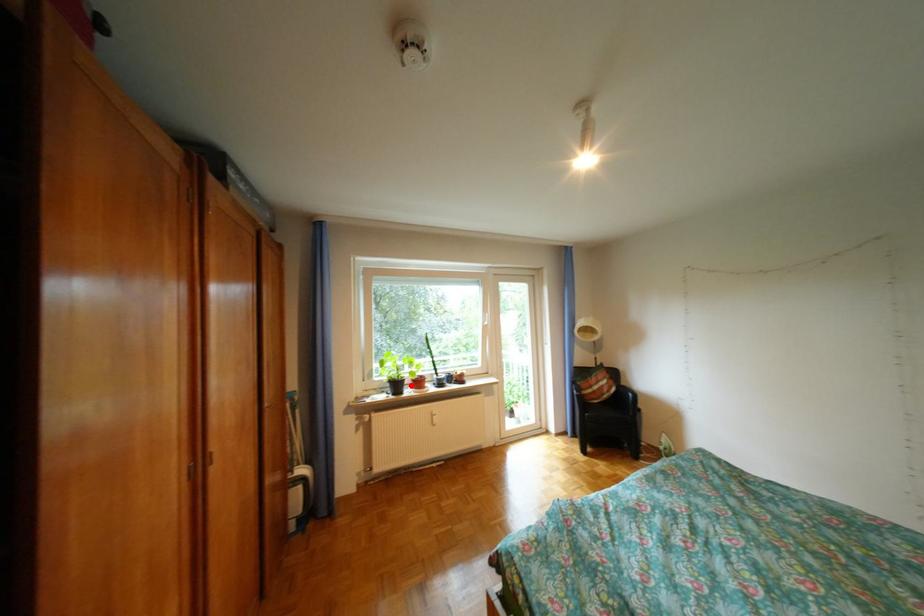
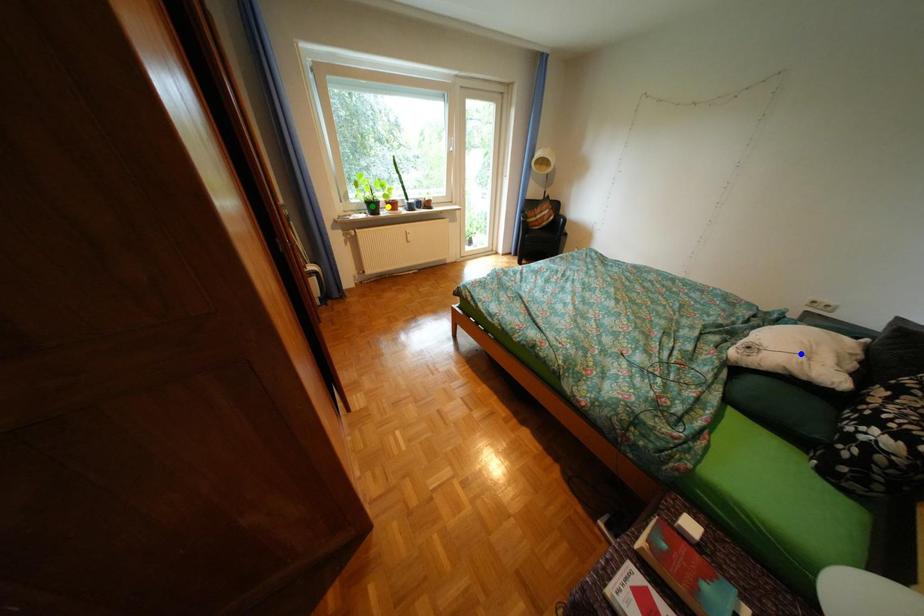
Question: I am providing you with two images of the same scene from different viewpoints. A red point is marked on the first image. You are given multiple points on the second image. Which point in image 2 is actually the same real-world point as the red point in image 1?

Choices:
 (A) blue point
 (B) green point
 (C) yellow point

Answer: (C)